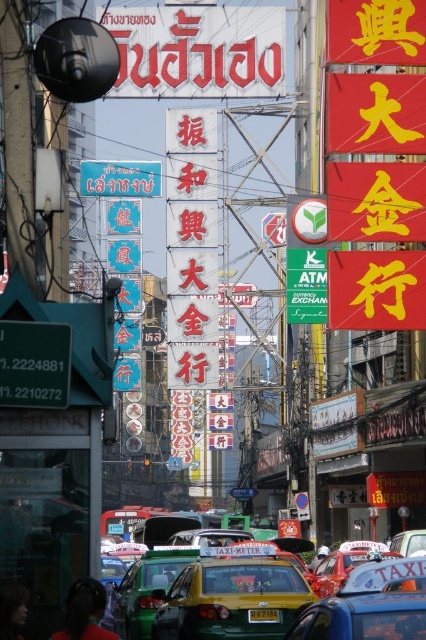
Which is behind, point (278, 557) or point (129, 579)?

Point (129, 579)

The width and height of the screenshot is (426, 640). Find the location of `yellow-green plastic taxi at center`. yellow-green plastic taxi at center is located at coordinates (233, 600).

What do you see at coordinates (198, 51) in the screenshot? Image resolution: width=426 pixels, height=640 pixels. I see `red matte sign at upper center` at bounding box center [198, 51].

Between red matte sign at upper center and red glossy sign at center, which one has more height?

red glossy sign at center is taller.

Who is more forward, (x=166, y=58) or (x=178, y=230)?

Positioned in front is point (x=166, y=58).

At what (x,y) coordinates should I click in order to perform the action: click on red matte sign at upper center. Please return your answer as a coordinate pair (x, y). This screenshot has width=426, height=640. Looking at the image, I should click on (198, 51).

You are a GUI agent. You are given a task and a screenshot of the screen. Output one action in this format:
    pyautogui.click(x=<x>, y=<y>)
    Task: Click on the red/yellow sign at center
    The width and height of the screenshot is (426, 640).
    Given the screenshot: What is the action you would take?
    pyautogui.click(x=374, y=113)

Which is more to the right, red/yellow sign at center or red glossy sign at center?

red/yellow sign at center

Is point (412, 42) closer to camera compared to point (204, 134)?

Yes.

You are a GUI agent. You are given a task and a screenshot of the screen. Output one action in this format:
    pyautogui.click(x=<x>, y=<y>)
    Task: Click on the red/yellow sign at center
    This screenshot has height=640, width=426.
    Given the screenshot: What is the action you would take?
    pyautogui.click(x=374, y=113)